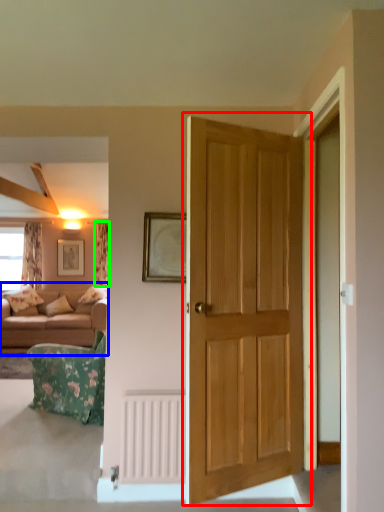
Question: Estimate the real-world distances between objects in this image. Which object is closer to door (highlighted by a red box), studio couch (highlighted by a blue box) or curtain (highlighted by a green box)?

Choices:
 (A) studio couch
 (B) curtain

Answer: (A)